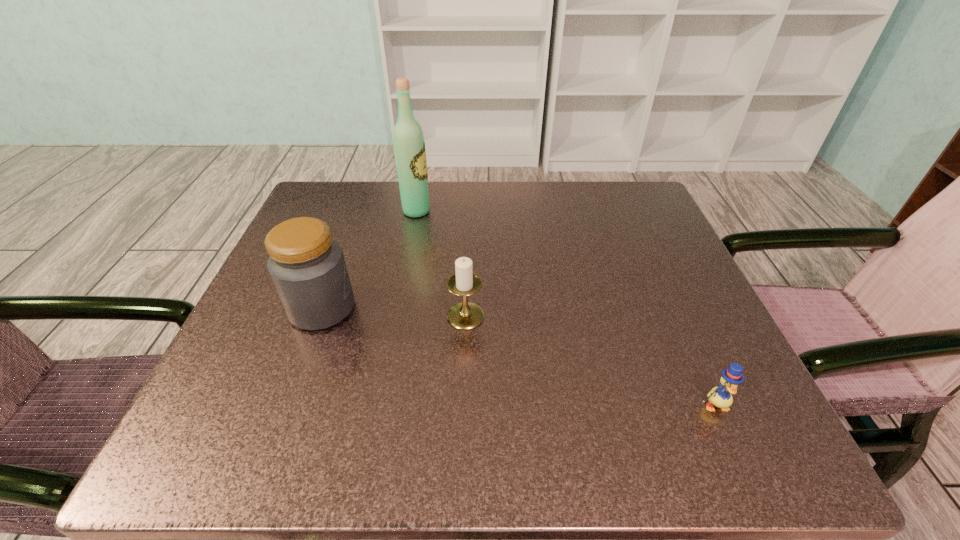
Image resolution: width=960 pixels, height=540 pixels. I want to click on free space between the shortest object and the third object from right to left, so click(x=565, y=308).

You are a GUI agent. You are given a task and a screenshot of the screen. Output one action in this format:
    pyautogui.click(x=<x>, y=<y>)
    Task: Click on the vacant area between the jar and the tallest object
    The height and width of the screenshot is (540, 960).
    Given the screenshot: What is the action you would take?
    pyautogui.click(x=370, y=260)

This screenshot has height=540, width=960. I want to click on free space between the jar and the third object from right to left, so click(370, 260).

At what (x,y) coordinates should I click in order to perform the action: click on object that stands as the second closest to the shortest object. Please return your answer as a coordinate pair (x, y). The width and height of the screenshot is (960, 540). Looking at the image, I should click on (307, 267).

This screenshot has width=960, height=540. I want to click on object that is the third closest to the farthest object, so click(x=721, y=397).

Where is `free space that satisfies the following two spatial constraints: 1. on the surface of the jar near the warning symbol; 2. on the right side of the third tallest object`? free space that satisfies the following two spatial constraints: 1. on the surface of the jar near the warning symbol; 2. on the right side of the third tallest object is located at coordinates (319, 316).

Locate an element on the screen. This screenshot has height=540, width=960. vacant region that satisfies the following two spatial constraints: 1. on the back side of the third object from left to right; 2. on the front-facing side of the third object from right to left is located at coordinates point(469,211).

I want to click on vacant point that satisfies the following two spatial constraints: 1. on the surface of the third tallest object near the warning symbol; 2. on the right side of the jar, so click(x=319, y=316).

Identify the location of vacant space that satisfies the following two spatial constraints: 1. on the surface of the third shortest object near the warning symbol; 2. on the back side of the second shortest object. The width and height of the screenshot is (960, 540). click(319, 316).

Where is `vacant region that satisfies the following two spatial constraints: 1. on the surface of the second tallest object near the warning symbol; 2. on the right side of the second object from right to left`? Image resolution: width=960 pixels, height=540 pixels. vacant region that satisfies the following two spatial constraints: 1. on the surface of the second tallest object near the warning symbol; 2. on the right side of the second object from right to left is located at coordinates (319, 316).